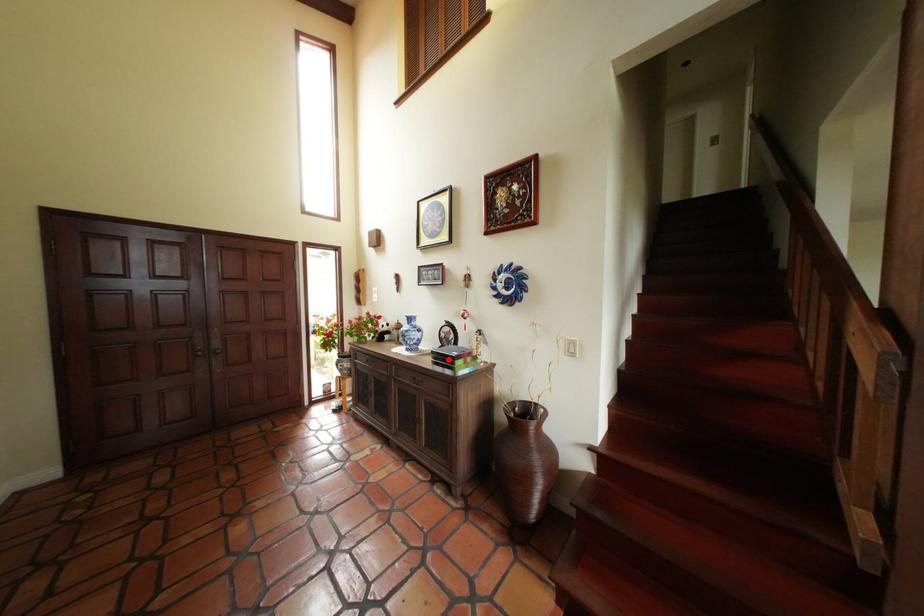
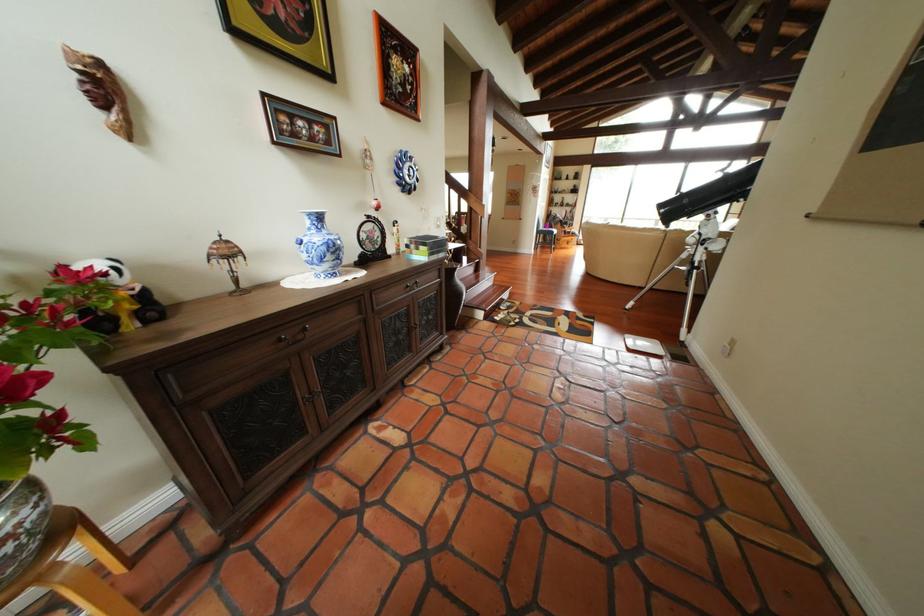
Question: I am providing you with two images of the same scene from different viewpoints. Image1 has a red point marked. In image2, the corresponding 3D location appears at what relative position? Reply with the corresponding letter.

Choices:
 (A) Closer
 (B) Farther

Answer: (A)